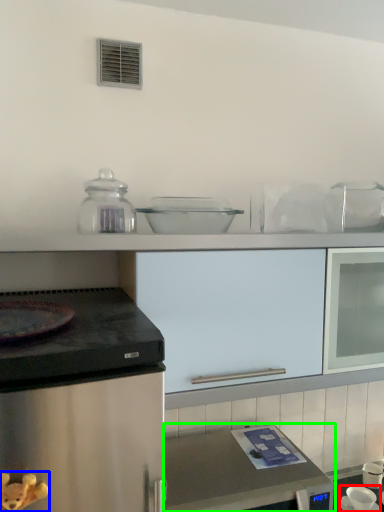
Question: Which object is positioned closest to appliance (highlighted by a red box)? Select from toy (highlighted by a blue box) and home appliance (highlighted by a green box).

Choices:
 (A) toy
 (B) home appliance

Answer: (B)